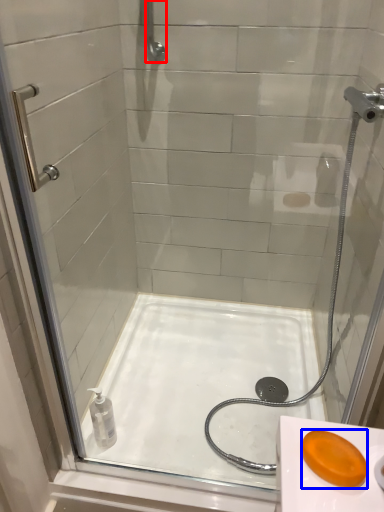
Question: Among these objects, which one is nearest to the camera, shower (highlighted by a red box) or soap (highlighted by a blue box)?

Choices:
 (A) shower
 (B) soap

Answer: (B)